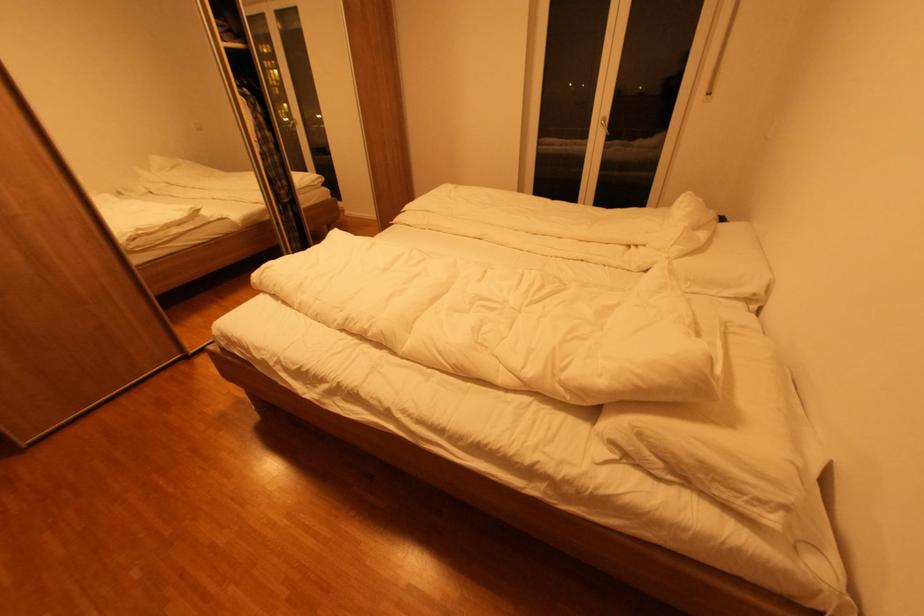
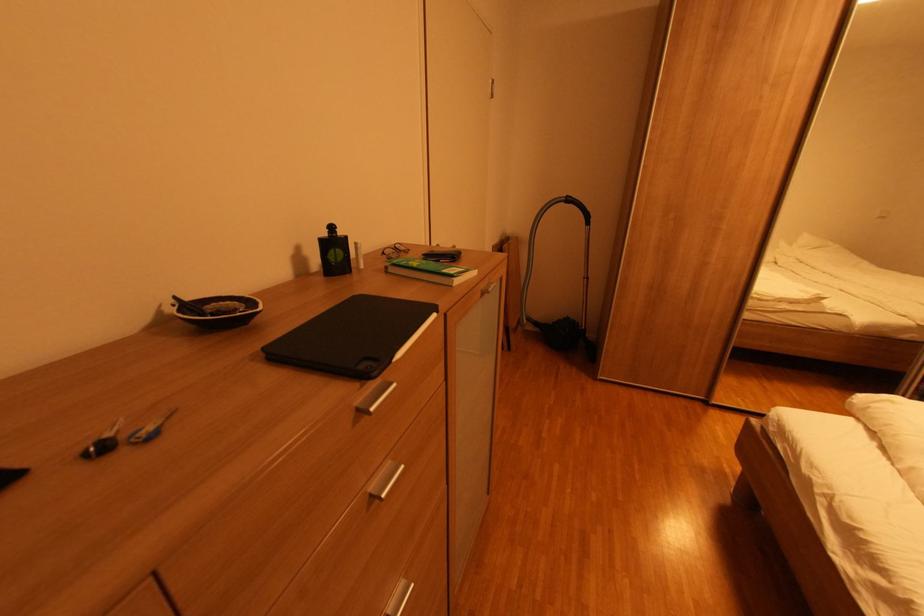
Based on the continuous images, in which direction is the camera rotating?

The camera's rotation is toward left-down.